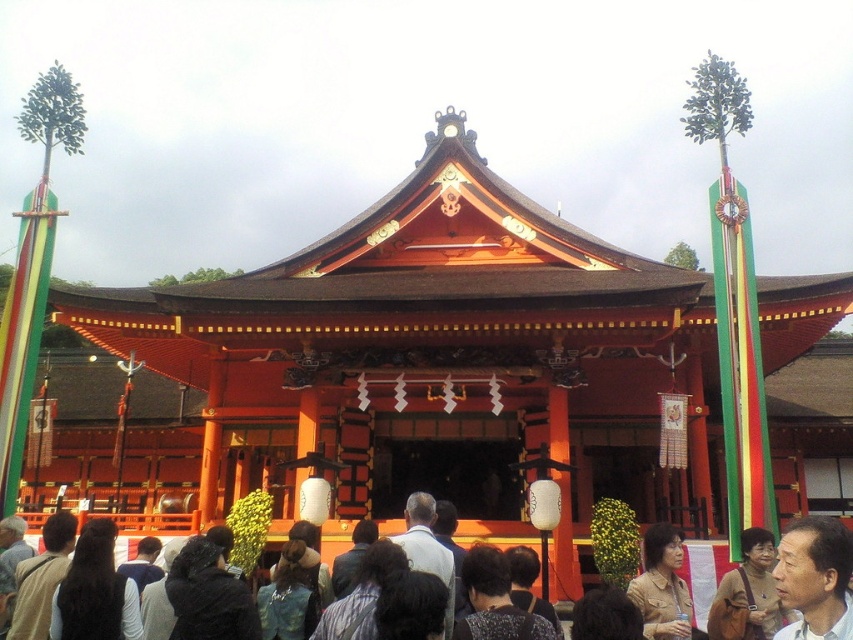
Between point (817, 544) and point (665, 561), which one is positioned in front?

Point (817, 544)

Measure the distance from smooth skin face at center to tan leather jacket at lower right.

smooth skin face at center and tan leather jacket at lower right are 2.88 meters apart.

The width and height of the screenshot is (853, 640). Identify the location of smooth skin face at center. (815, 579).

Locate an element on the screen. The image size is (853, 640). smooth skin face at center is located at coordinates (815, 579).